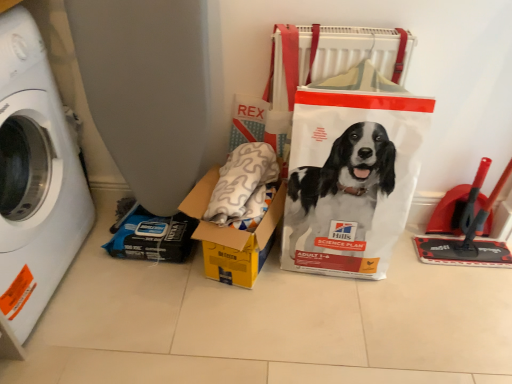
Question: Does white plastic bag at center have a greater width compared to white plastic washing machine at left?

Choices:
 (A) no
 (B) yes

Answer: (A)

Question: Does white plastic bag at center have a lesser height compared to white plastic washing machine at left?

Choices:
 (A) no
 (B) yes

Answer: (B)

Question: Considering the relative positions of white plastic bag at center and white plastic washing machine at left in the image provided, is white plastic bag at center in front of white plastic washing machine at left?

Choices:
 (A) no
 (B) yes

Answer: (A)

Question: Are white plastic bag at center and white plastic washing machine at left beside each other?

Choices:
 (A) no
 (B) yes

Answer: (A)

Question: Is white plastic bag at center not inside white plastic washing machine at left?

Choices:
 (A) yes
 (B) no

Answer: (A)

Question: Is white plastic washing machine at left a part of white plastic bag at center?

Choices:
 (A) no
 (B) yes

Answer: (A)

Question: Could yellow cardboard box at center be considered to be inside white plastic bag at center?

Choices:
 (A) no
 (B) yes

Answer: (A)

Question: Is white plastic bag at center closer to camera compared to yellow cardboard box at center?

Choices:
 (A) yes
 (B) no

Answer: (A)

Question: Considering the relative sizes of white plastic bag at center and yellow cardboard box at center in the image provided, is white plastic bag at center bigger than yellow cardboard box at center?

Choices:
 (A) yes
 (B) no

Answer: (A)

Question: Is white plastic bag at center to the right of yellow cardboard box at center from the viewer's perspective?

Choices:
 (A) no
 (B) yes

Answer: (B)

Question: From the image's perspective, is white plastic bag at center on yellow cardboard box at center?

Choices:
 (A) no
 (B) yes

Answer: (B)

Question: Would you say white plastic bag at center is a long distance from yellow cardboard box at center?

Choices:
 (A) no
 (B) yes

Answer: (A)

Question: Is the depth of yellow cardboard box at center greater than that of white plastic bag at center?

Choices:
 (A) no
 (B) yes

Answer: (B)